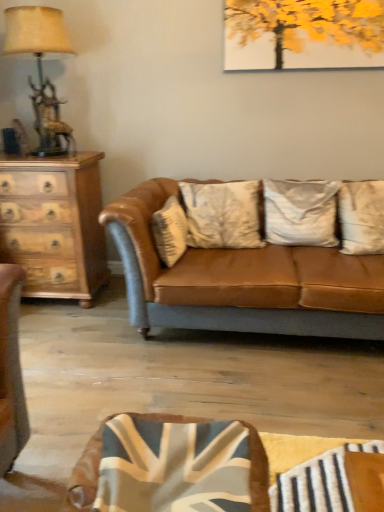
Question: Is matte gold table lamp at left outside of white textured pillow at center, which is counted as the 3th pillow, starting from the right?

Choices:
 (A) yes
 (B) no

Answer: (A)

Question: Is matte gold table lamp at left shorter than white textured pillow at center, the first pillow viewed from the left?

Choices:
 (A) no
 (B) yes

Answer: (A)

Question: Is matte gold table lamp at left thinner than white textured pillow at center, which is counted as the 3th pillow, starting from the right?

Choices:
 (A) yes
 (B) no

Answer: (B)

Question: Is matte gold table lamp at left with white textured pillow at center, which is counted as the 3th pillow, starting from the right?

Choices:
 (A) no
 (B) yes

Answer: (A)

Question: Is matte gold table lamp at left at the left side of white textured pillow at center, the first pillow viewed from the left?

Choices:
 (A) yes
 (B) no

Answer: (A)

Question: Considering the positions of silky white pillow at center, which ranks as the 1th pillow in right-to-left order, and matte gold table lamp at left in the image, is silky white pillow at center, which ranks as the 1th pillow in right-to-left order, taller or shorter than matte gold table lamp at left?

Choices:
 (A) short
 (B) tall

Answer: (A)

Question: Relative to matte gold table lamp at left, is silky white pillow at center, the third pillow positioned from the left, in front or behind?

Choices:
 (A) behind
 (B) front

Answer: (B)

Question: Considering the relative positions of silky white pillow at center, which ranks as the 1th pillow in right-to-left order, and matte gold table lamp at left in the image provided, is silky white pillow at center, which ranks as the 1th pillow in right-to-left order, to the left or to the right of matte gold table lamp at left?

Choices:
 (A) left
 (B) right

Answer: (B)

Question: Does point (339, 190) appear closer or farther from the camera than point (13, 10)?

Choices:
 (A) closer
 (B) farther

Answer: (B)

Question: Is point (331, 317) closer or farther from the camera than point (183, 218)?

Choices:
 (A) farther
 (B) closer

Answer: (B)

Question: From the image's perspective, is matte brown leather couch at center located above or below white textured pillow at center, the first pillow viewed from the left?

Choices:
 (A) below
 (B) above

Answer: (A)

Question: From their relative heights in the image, would you say matte brown leather couch at center is taller or shorter than white textured pillow at center, which is counted as the 3th pillow, starting from the right?

Choices:
 (A) short
 (B) tall

Answer: (B)

Question: Based on their positions, is matte brown leather couch at center located to the left or right of white textured pillow at center, the first pillow viewed from the left?

Choices:
 (A) left
 (B) right

Answer: (B)

Question: From the image's perspective, relative to matte gold table lamp at left, is wooden chest of drawers at left above or below?

Choices:
 (A) below
 (B) above

Answer: (A)

Question: Would you say wooden chest of drawers at left is inside or outside matte gold table lamp at left?

Choices:
 (A) inside
 (B) outside

Answer: (B)